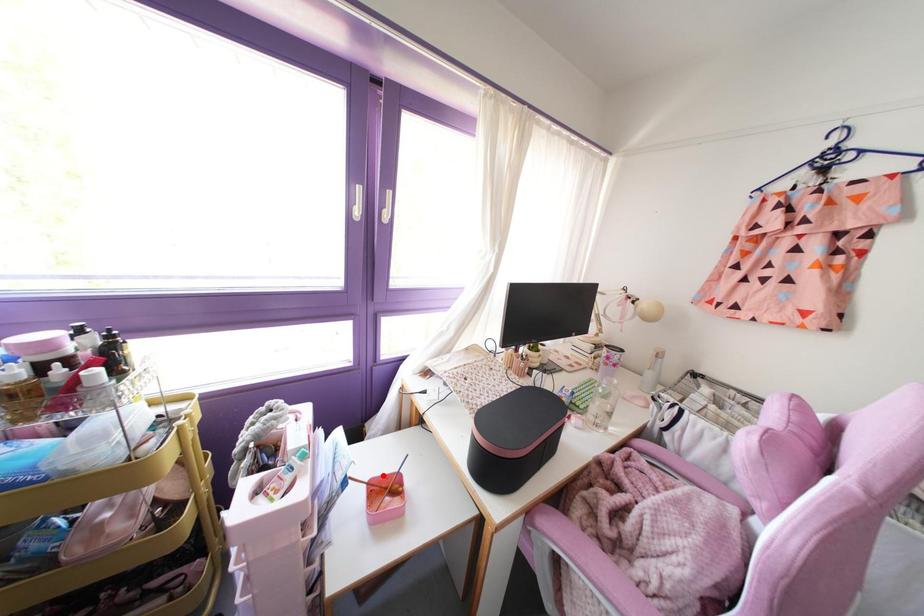
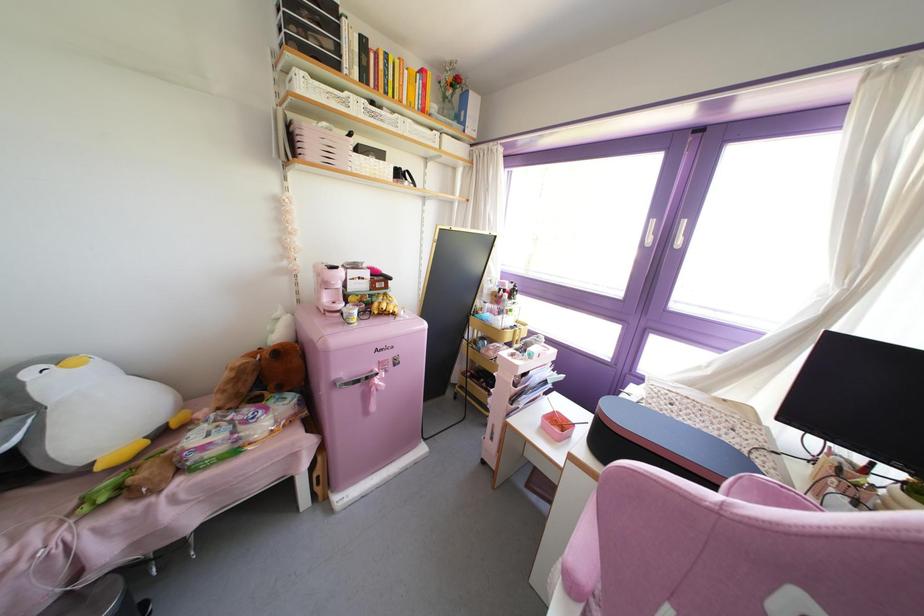
Find the pixel in the second image that matches the highlighted location in the first image.

(565, 418)